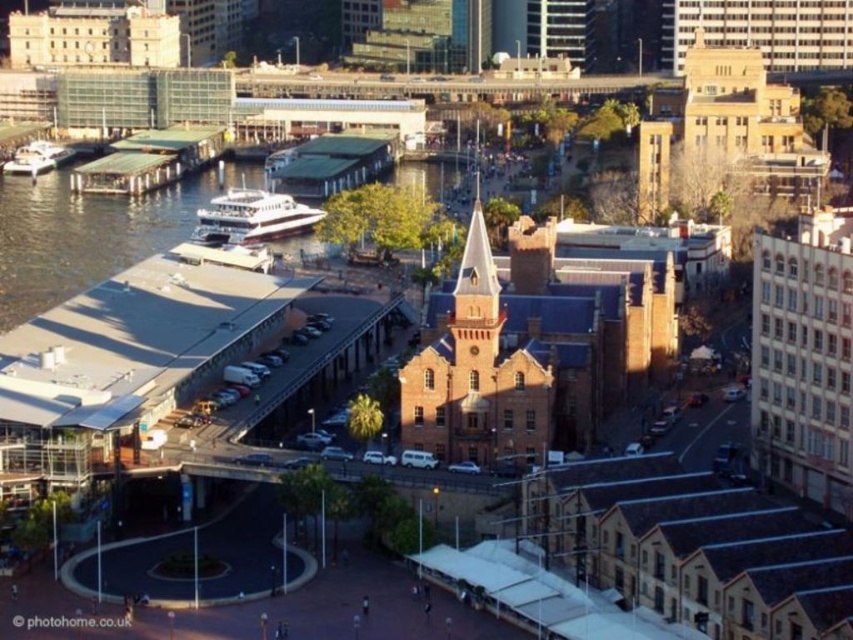
Describe the element at coordinates (251, 218) in the screenshot. I see `white glossy ferry at upper left` at that location.

Is white glossy ferry at upper left below white glossy boat at left?

Yes.

Where is `white glossy ferry at upper left`? The width and height of the screenshot is (853, 640). white glossy ferry at upper left is located at coordinates (251, 218).